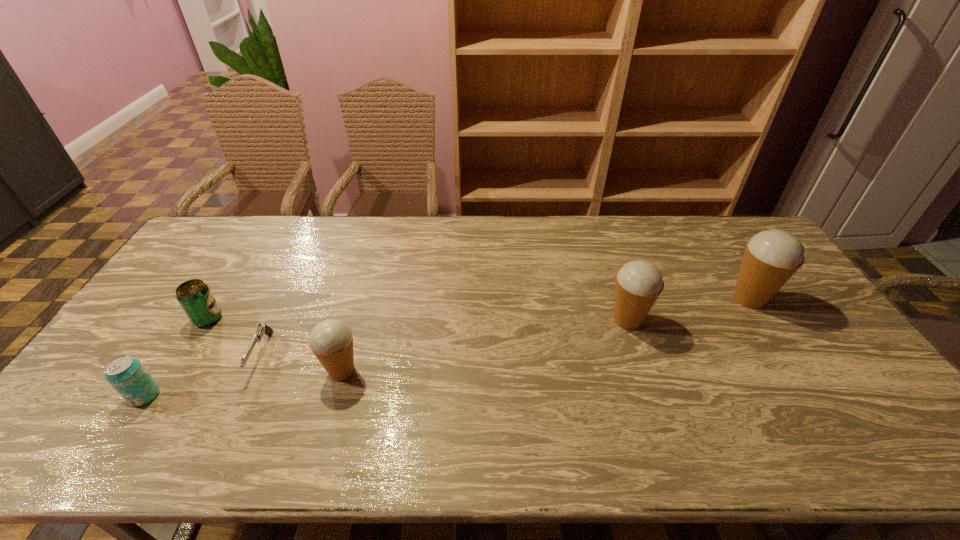
To achieve uniform spacing by inserting another icecream among them, please point to a free space for this new icecream. Please provide its 2D coordinates. Your answer should be formatted as a tuple, i.e. [(x, y)], where the tuple contains the x and y coordinates of a point satisfying the conditions above.

[(492, 345)]